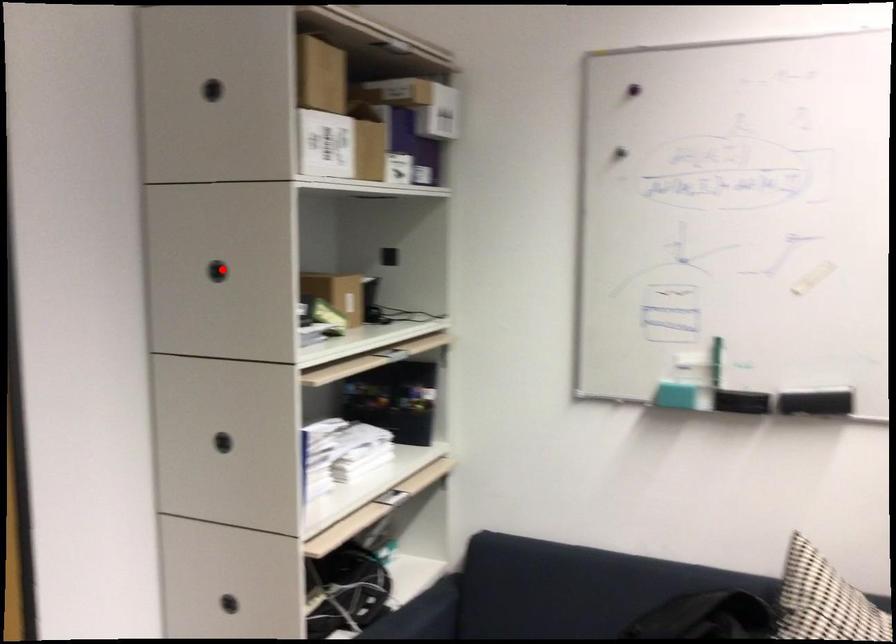
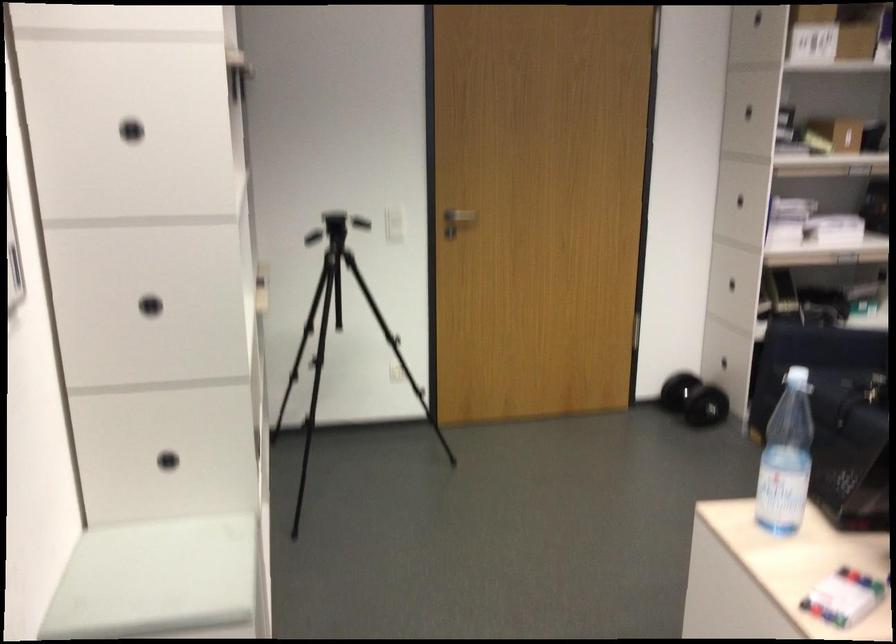
Question: I am providing you with two images of the same scene from different viewpoints. A red point is shown in image1. For the corresponding object point in image2, is it positioned nearer or farther from the camera?

Choices:
 (A) Nearer
 (B) Farther

Answer: (B)